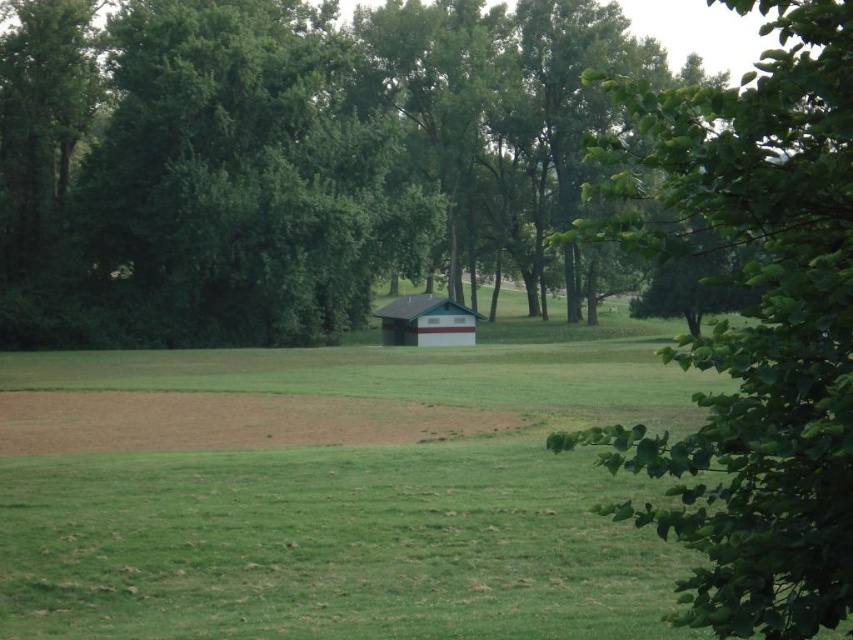
Question: Considering the real-world distances, which object is farthest from the green leafy tree at center?

Choices:
 (A) green shingled barn at center
 (B) green leafy tree at center right

Answer: (B)

Question: Is green leafy tree at center right in front of green shingled barn at center?

Choices:
 (A) yes
 (B) no

Answer: (A)

Question: Which object is closer to the camera taking this photo?

Choices:
 (A) green leafy tree at center
 (B) green shingled barn at center
 (C) green leafy tree at center right

Answer: (C)

Question: Which object is positioned farthest from the green leafy tree at center?

Choices:
 (A) green shingled barn at center
 (B) green leafy tree at center right

Answer: (B)

Question: Does green leafy tree at center have a lesser width compared to green leafy tree at center right?

Choices:
 (A) no
 (B) yes

Answer: (A)

Question: Is the position of green leafy tree at center right more distant than that of green shingled barn at center?

Choices:
 (A) no
 (B) yes

Answer: (A)